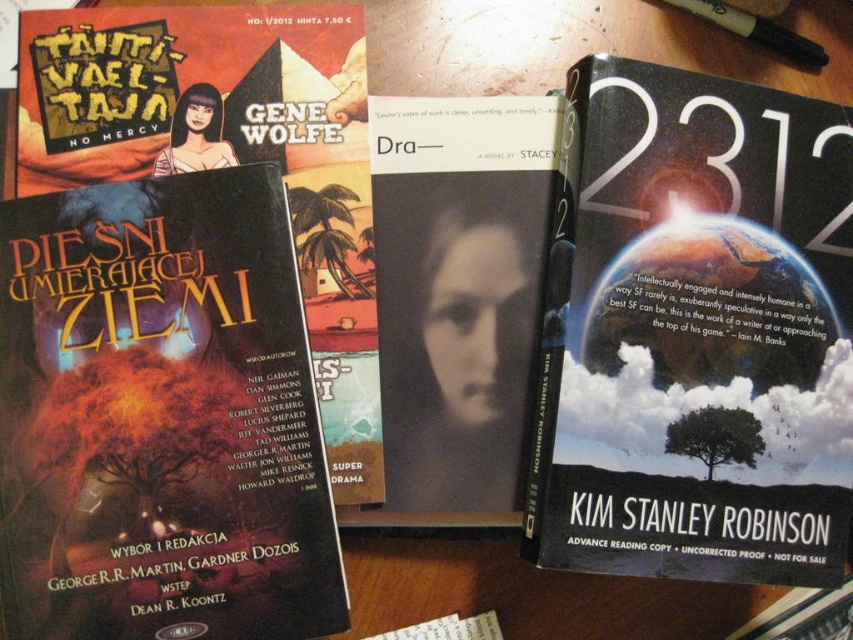
You are looking at the book cover with the fiery scene. There are two points marked on it. If you were to touch the point at coordinate (753, 188) and then the point at (509, 144), which point would feel closer to your hand?

The point at coordinate (753, 188) is closer to the camera than the point at (509, 144), so touching it would feel closer to your hand.

You are organizing a display of science fiction books and notice the matte black book at center and the black plastic pen at upper right. Which object is taller?

The matte black book at center is taller than the black plastic pen at upper right.

You are organizing books on a shelf and need to place the hardcover book at right. Where should you place it?

The hardcover book at right should be placed at point [695,332].